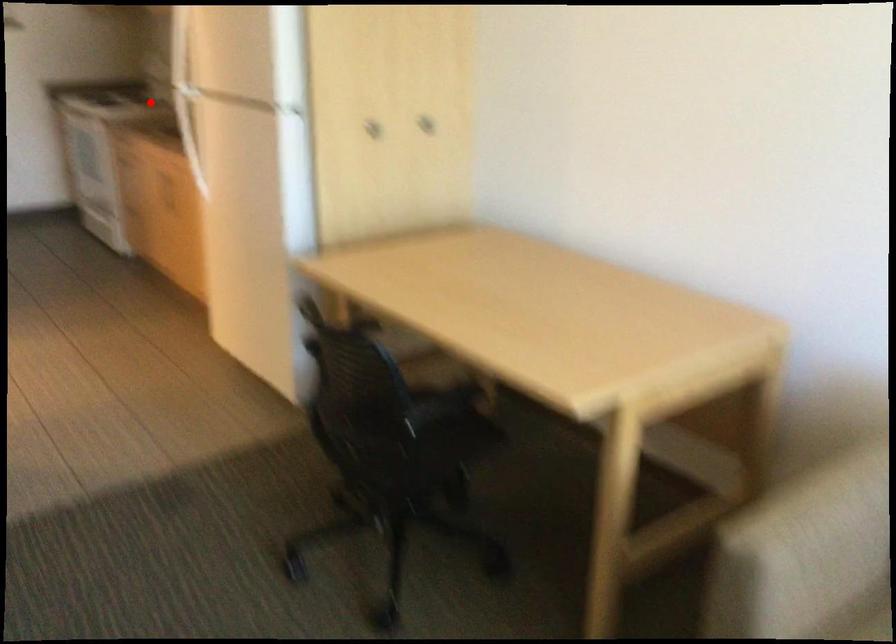
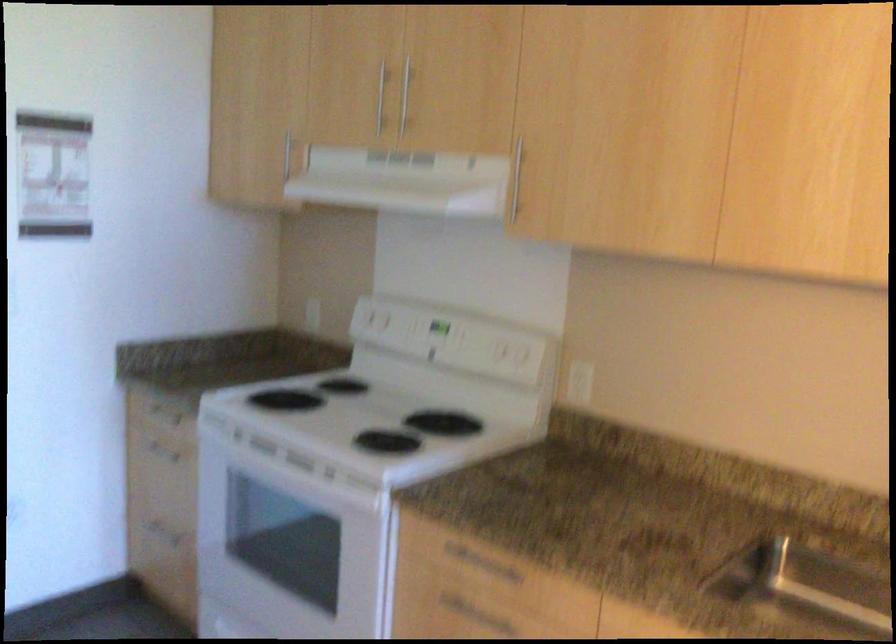
Question: I am providing you with two images of the same scene from different viewpoints. Image1 has a red point marked. In image2, the corresponding 3D location appears at what relative position? Reply with the corresponding letter.

Choices:
 (A) Closer
 (B) Farther

Answer: (A)